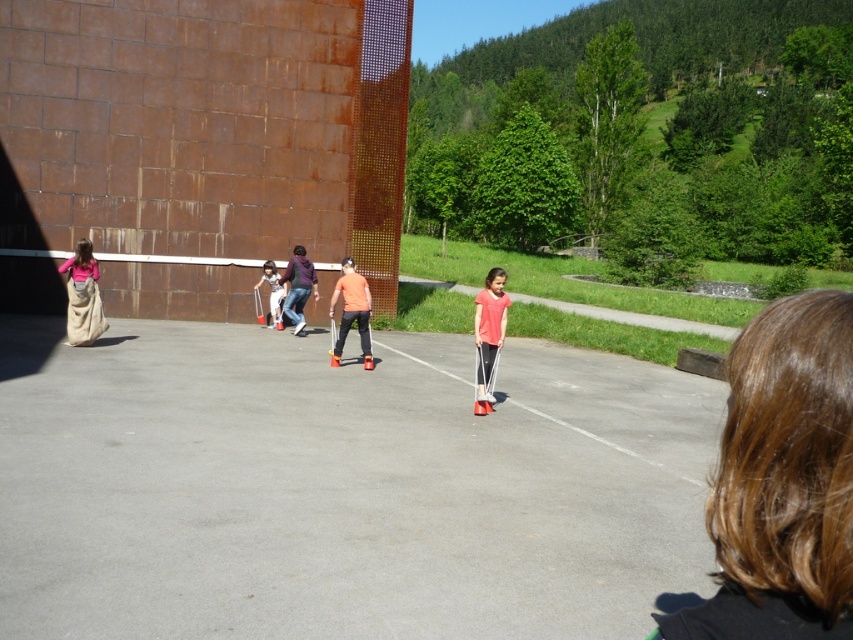
Question: Which is nearer to the brown hair at upper right?

Choices:
 (A) matte white pants at center
 (B) orange matte shirt at center
 (C) pink matte shirt at center

Answer: (C)

Question: Considering the relative positions of brown hair at upper right and orange matte shirt at center in the image provided, where is brown hair at upper right located with respect to orange matte shirt at center?

Choices:
 (A) below
 (B) above

Answer: (A)

Question: Which point is farther to the camera?

Choices:
 (A) beige canvas sack at left
 (B) pink matte shirt at center
 (C) brown hair at upper right
 (D) orange matte shirt at center

Answer: (D)

Question: Can you confirm if brown hair at upper right is positioned above matte orange shirt at center?

Choices:
 (A) no
 (B) yes

Answer: (A)

Question: Among these objects, which one is nearest to the camera?

Choices:
 (A) matte white pants at center
 (B) matte orange shirt at center
 (C) pink matte shirt at center

Answer: (C)

Question: Does beige canvas sack at left have a larger size compared to matte white pants at center?

Choices:
 (A) yes
 (B) no

Answer: (A)